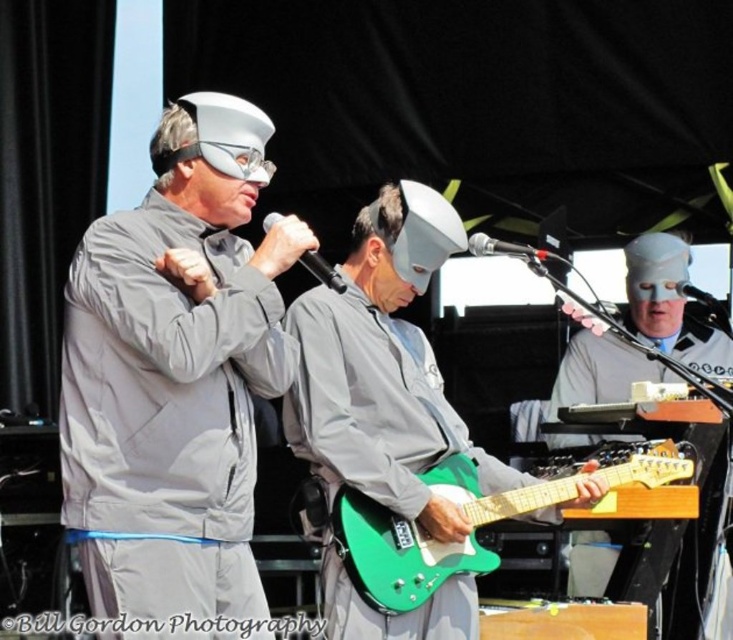
Question: Which object is positioned farthest from the matte gray mask at center?

Choices:
 (A) matte gray suit at center
 (B) green matte electric guitar at center
 (C) green glossy electric guitar at center

Answer: (A)

Question: Can you confirm if green matte electric guitar at center is bigger than green glossy electric guitar at center?

Choices:
 (A) yes
 (B) no

Answer: (A)

Question: Does matte gray suit at center appear on the right side of green glossy electric guitar at center?

Choices:
 (A) no
 (B) yes

Answer: (A)

Question: Which object appears closest to the camera in this image?

Choices:
 (A) matte gray suit at center
 (B) green matte electric guitar at center

Answer: (A)

Question: Considering the relative positions of green matte electric guitar at center and matte gray mask at center in the image provided, where is green matte electric guitar at center located with respect to matte gray mask at center?

Choices:
 (A) below
 (B) above

Answer: (B)

Question: Which point appears farthest from the camera in this image?

Choices:
 (A) (452, 465)
 (B) (305, 458)

Answer: (A)